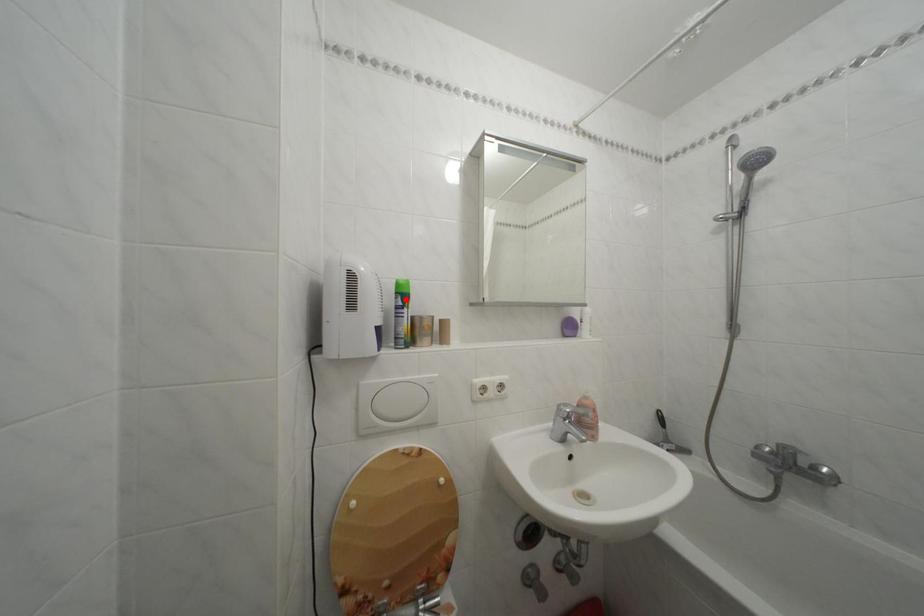
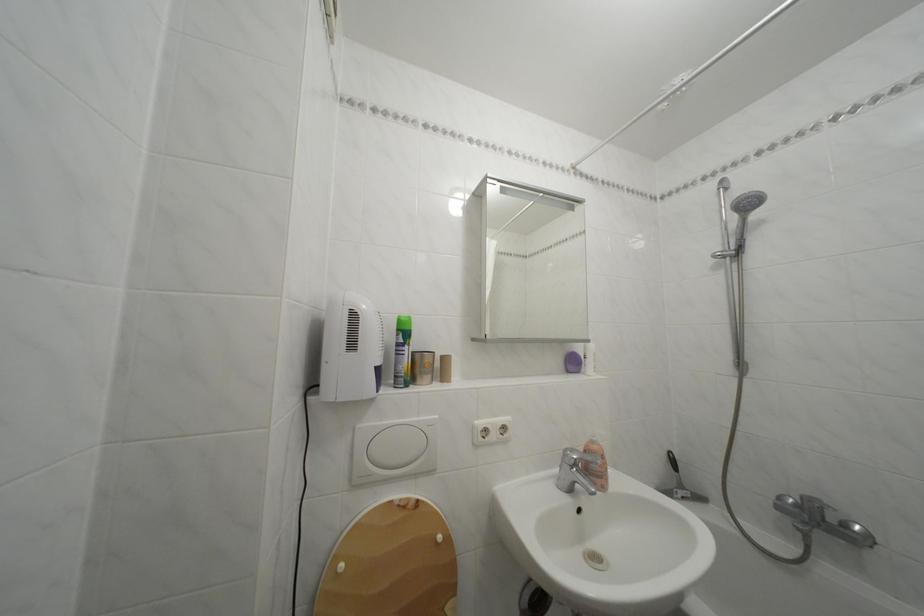
In the second image, find the point that corresponds to the highlighted location in the first image.

(407, 336)